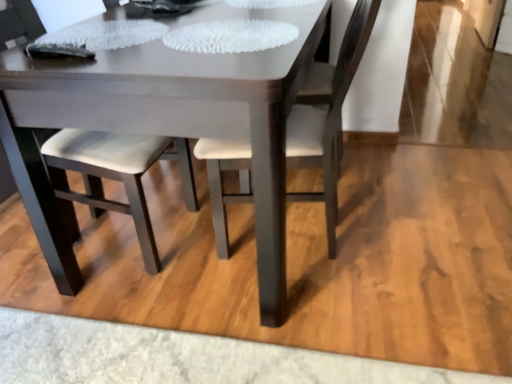
Find the location of a particular element. The image size is (512, 384). free spot in front of white leather chair at center, placed as the first chair when sorted from right to left is located at coordinates (318, 331).